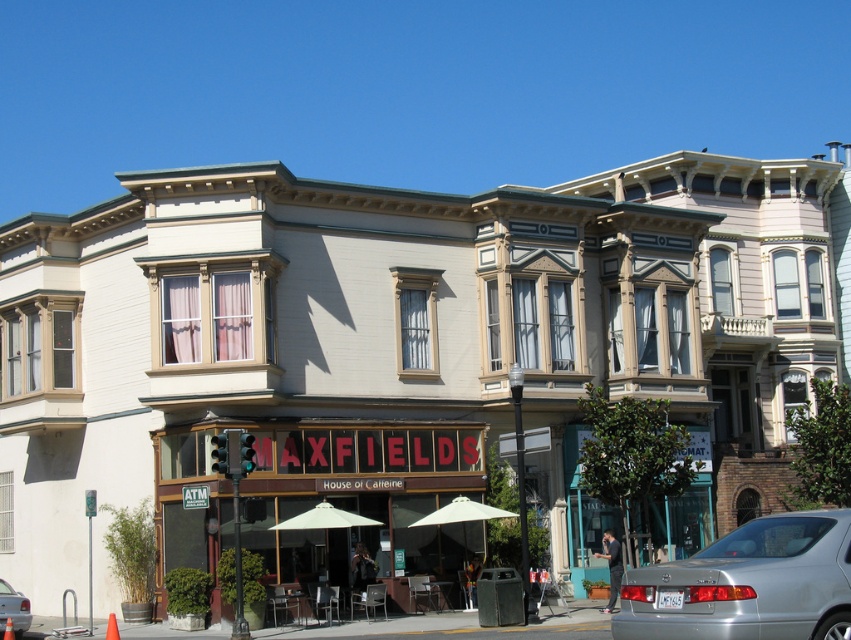
Looking at this image, can you confirm if silver metallic sedan at lower right is shorter than silver metallic sedan at lower left?

Incorrect, silver metallic sedan at lower right's height does not fall short of silver metallic sedan at lower left's.

Is silver metallic sedan at lower right positioned in front of silver metallic sedan at lower left?

Yes, it is in front of silver metallic sedan at lower left.

The image size is (851, 640). What do you see at coordinates (747, 584) in the screenshot?
I see `silver metallic sedan at lower right` at bounding box center [747, 584].

Find the location of a particular element. The image size is (851, 640). silver metallic sedan at lower right is located at coordinates (747, 584).

From the picture: Is matte red sign at center wider than silver metallic sedan at lower right?

Correct, the width of matte red sign at center exceeds that of silver metallic sedan at lower right.

Which is behind, point (181, 540) or point (809, 595)?

Point (181, 540)

Where is `matte red sign at center`? Image resolution: width=851 pixels, height=640 pixels. matte red sign at center is located at coordinates (364, 500).

Is point (375, 432) farther from viewer compared to point (13, 618)?

Yes, point (375, 432) is farther from viewer.

Measure the distance between point [346,588] and camera.

The distance of point [346,588] from camera is 117.95 feet.

What are the coordinates of `matte red sign at center` in the screenshot? It's located at (364, 500).